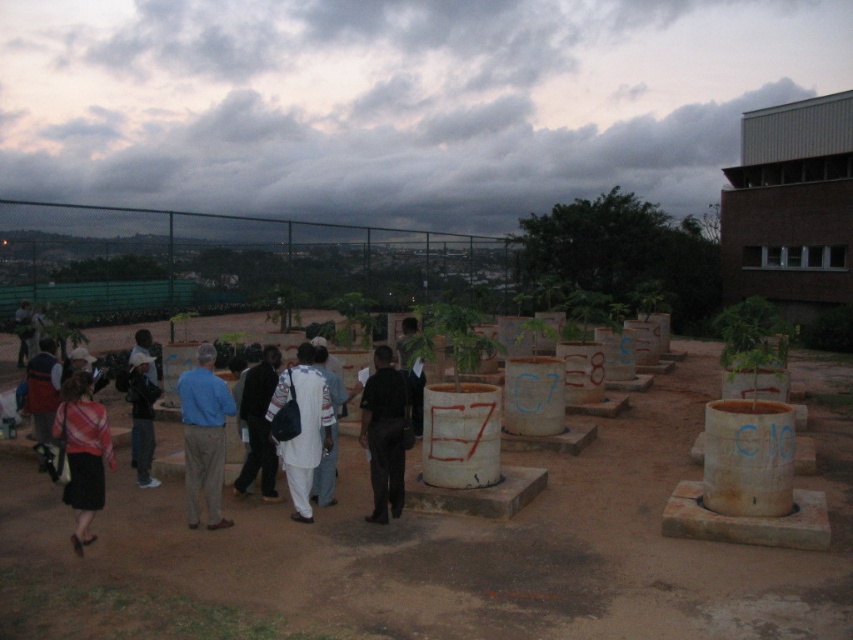
Can you confirm if striped fabric skirt at lower left is wider than black smooth jacket at center?

Yes.

At what (x,y) coordinates should I click in order to perform the action: click on striped fabric skirt at lower left. Please return your answer as a coordinate pair (x, y). This screenshot has width=853, height=640. Looking at the image, I should click on (83, 452).

Image resolution: width=853 pixels, height=640 pixels. In order to click on striped fabric skirt at lower left in this screenshot , I will do `click(83, 452)`.

Does dark blue jeans at left appear on the left side of matte black shirt at center?

In fact, dark blue jeans at left is to the right of matte black shirt at center.

Is dark blue jeans at left in front of matte black shirt at center?

Yes, dark blue jeans at left is in front of matte black shirt at center.

Which is in front, point (138, 452) or point (155, 364)?

Point (138, 452) is in front.

Identify the location of dark blue jeans at left. (142, 417).

Which is behind, point (553, 282) or point (16, 308)?

The point (553, 282) is more distant.

Which of these two, green leafy tree at center or light brown leather jacket at center, stands taller?

green leafy tree at center is taller.

Between point (570, 244) and point (19, 336), which one is positioned behind?

The point (570, 244) is behind.

This screenshot has height=640, width=853. In order to click on green leafy tree at center in this screenshot , I will do `click(624, 253)`.